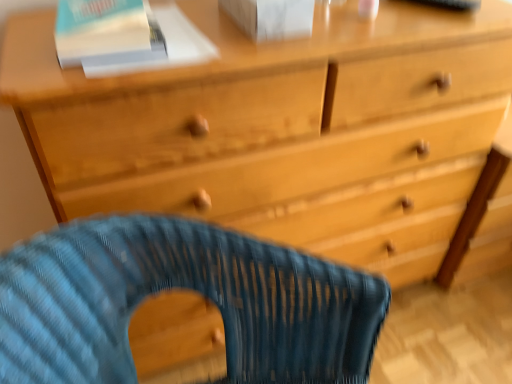
Question: Is white paper at upper left, marked as the 2th paperback book in a right-to-left arrangement, beside blue woven fabric rocking chair at lower center?

Choices:
 (A) no
 (B) yes

Answer: (A)

Question: Can you confirm if white paper at upper left, marked as the 2th paperback book in a right-to-left arrangement, is taller than blue woven fabric rocking chair at lower center?

Choices:
 (A) yes
 (B) no

Answer: (B)

Question: Is white paper at upper left, the 1th paperback book positioned from the left, completely or partially outside of blue woven fabric rocking chair at lower center?

Choices:
 (A) no
 (B) yes

Answer: (B)

Question: Is white paper at upper left, marked as the 2th paperback book in a right-to-left arrangement, facing away from blue woven fabric rocking chair at lower center?

Choices:
 (A) yes
 (B) no

Answer: (B)

Question: Does white paper at upper left, the 1th paperback book positioned from the left, lie in front of blue woven fabric rocking chair at lower center?

Choices:
 (A) yes
 (B) no

Answer: (B)

Question: Is white paper at upper left, marked as the 2th paperback book in a right-to-left arrangement, taller or shorter than blue woven fabric rocking chair at lower center?

Choices:
 (A) tall
 (B) short

Answer: (B)

Question: Does point (206, 59) appear closer or farther from the camera than point (29, 246)?

Choices:
 (A) closer
 (B) farther

Answer: (B)

Question: Based on their positions, is white paper at upper left, marked as the 2th paperback book in a right-to-left arrangement, located to the left or right of blue woven fabric rocking chair at lower center?

Choices:
 (A) right
 (B) left

Answer: (B)

Question: From the image's perspective, is white paper at upper left, marked as the 2th paperback book in a right-to-left arrangement, located above or below blue woven fabric rocking chair at lower center?

Choices:
 (A) below
 (B) above

Answer: (B)

Question: From the image's perspective, relative to blue woven fabric rocking chair at lower center, is white matte paperback book at upper center, the second paperback book positioned from the left, above or below?

Choices:
 (A) above
 (B) below

Answer: (A)

Question: Considering the positions of point (278, 8) and point (238, 296), is point (278, 8) closer or farther from the camera than point (238, 296)?

Choices:
 (A) farther
 (B) closer

Answer: (A)

Question: In terms of height, does white matte paperback book at upper center, the second paperback book positioned from the left, look taller or shorter compared to blue woven fabric rocking chair at lower center?

Choices:
 (A) short
 (B) tall

Answer: (A)

Question: Considering the positions of white matte paperback book at upper center, the second paperback book positioned from the left, and blue woven fabric rocking chair at lower center in the image, is white matte paperback book at upper center, the second paperback book positioned from the left, wider or thinner than blue woven fabric rocking chair at lower center?

Choices:
 (A) thin
 (B) wide

Answer: (A)

Question: Considering the positions of blue woven fabric rocking chair at lower center and white matte paperback book at upper center, which is counted as the first paperback book, starting from the right, in the image, is blue woven fabric rocking chair at lower center bigger or smaller than white matte paperback book at upper center, which is counted as the first paperback book, starting from the right,?

Choices:
 (A) small
 (B) big

Answer: (B)

Question: Is blue woven fabric rocking chair at lower center situated inside white matte paperback book at upper center, the second paperback book positioned from the left, or outside?

Choices:
 (A) inside
 (B) outside

Answer: (B)